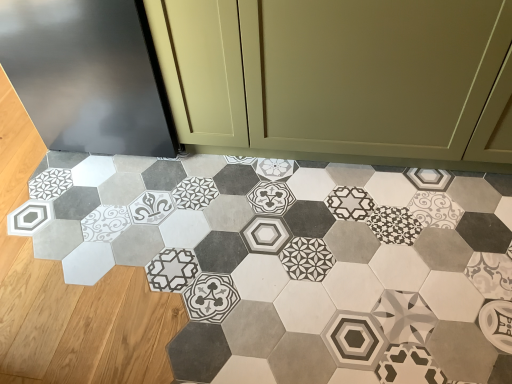
Question: From their relative heights in the image, would you say matte olive green cabinet at center is taller or shorter than patterned hexagonal tile at center?

Choices:
 (A) tall
 (B) short

Answer: (A)

Question: Is matte olive green cabinet at center to the left or to the right of patterned hexagonal tile at center in the image?

Choices:
 (A) left
 (B) right

Answer: (B)

Question: In terms of width, does matte olive green cabinet at center look wider or thinner when compared to patterned hexagonal tile at center?

Choices:
 (A) thin
 (B) wide

Answer: (A)

Question: Is point (362, 238) closer or farther from the camera than point (436, 92)?

Choices:
 (A) closer
 (B) farther

Answer: (B)

Question: Is patterned hexagonal tile at center to the left or to the right of matte olive green cabinet at center in the image?

Choices:
 (A) left
 (B) right

Answer: (A)

Question: Is patterned hexagonal tile at center in front of or behind matte olive green cabinet at center in the image?

Choices:
 (A) behind
 (B) front

Answer: (B)

Question: From a real-world perspective, relative to matte olive green cabinet at center, is patterned hexagonal tile at center vertically above or below?

Choices:
 (A) above
 (B) below

Answer: (B)